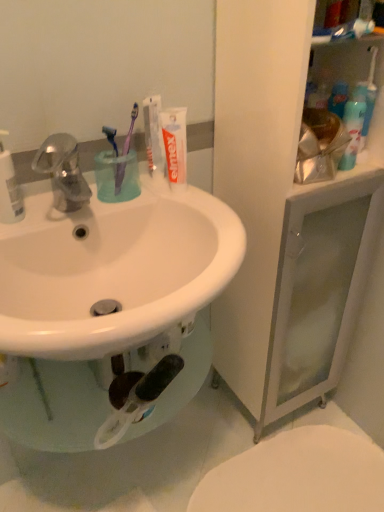
Where is `vacant space to the right of matte silver faucet at upper left`? vacant space to the right of matte silver faucet at upper left is located at coordinates (152, 200).